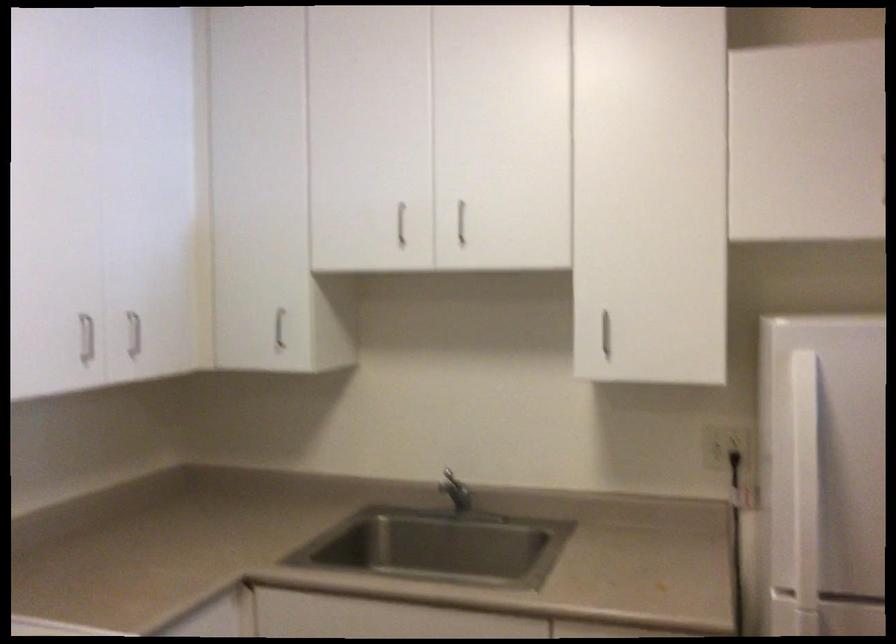
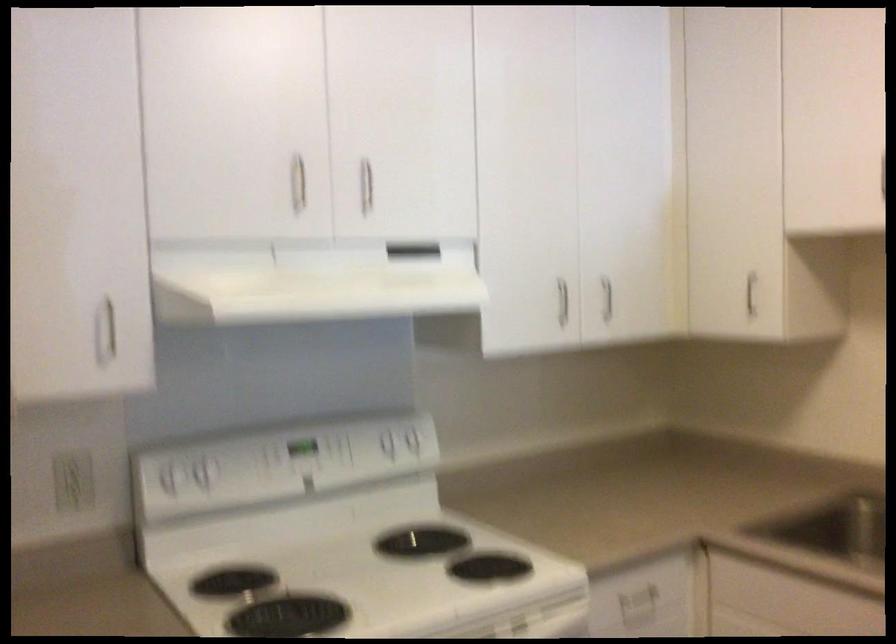
Find the pixel in the second image that matches point 81,339 in the first image.

(562, 301)